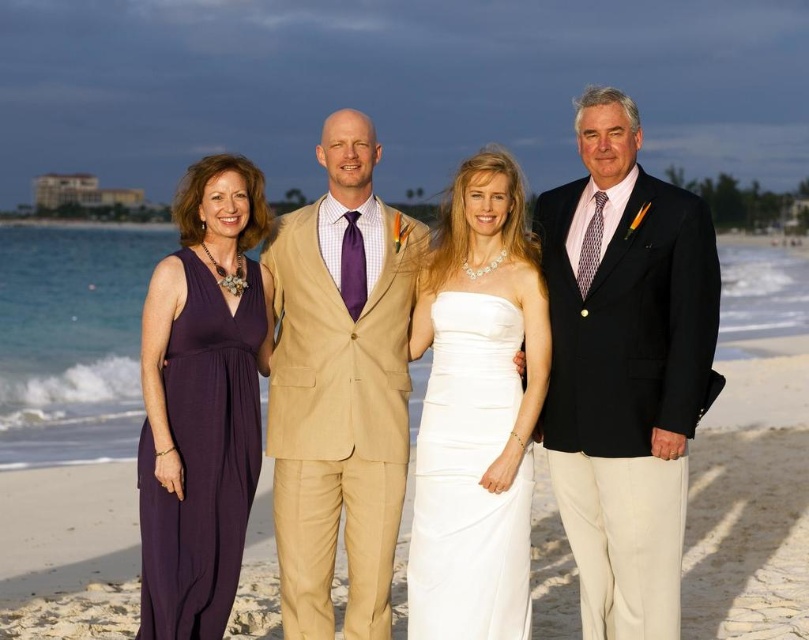
Based on the photo, you are a photographer standing at the origin point of the coordinate system. You need to take a photo of the beige textured suit at center. What are the coordinates where you should aim your camera?

The coordinates to aim the camera are at point (341,387).

You are standing on the beach and want to walk towards the closest point between point (527, 477) and point (168, 332). Which point should you head towards first?

Point (168, 332) is closer to you than point (527, 477), so you should head towards point (168, 332) first.